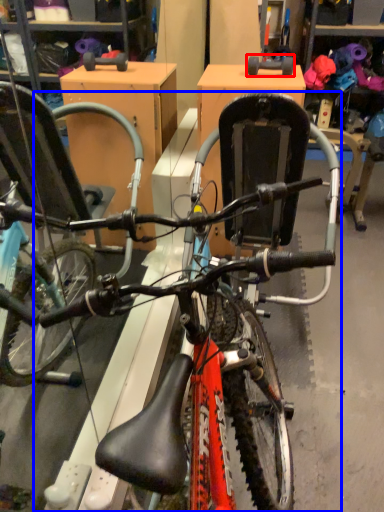
Question: Which object appears farthest to the camera in this image, wheel (highlighted by a red box) or bicycle (highlighted by a blue box)?

Choices:
 (A) wheel
 (B) bicycle

Answer: (A)